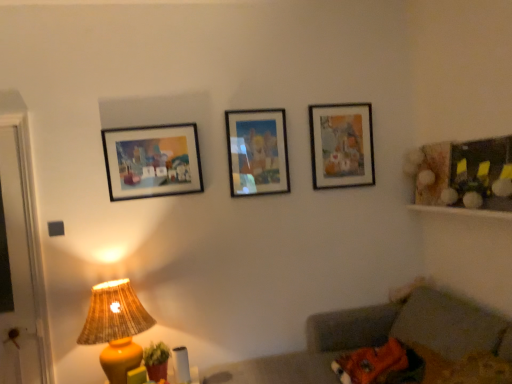
Question: Is matte wooden picture frame at upper right, marked as the 1th picture frame in a right-to-left arrangement, in front of or behind matte plastic picture frame at center, the second picture frame viewed from the left, in the image?

Choices:
 (A) behind
 (B) front

Answer: (A)

Question: Based on their sizes in the image, would you say matte wooden picture frame at upper right, the 3th picture frame when ordered from left to right, is bigger or smaller than matte plastic picture frame at center, positioned as the 2th picture frame in front-to-back order?

Choices:
 (A) big
 (B) small

Answer: (A)

Question: Estimate the real-world distances between objects in this image. Which object is closer to the matte wooden picture frame at upper right, which ranks as the first picture frame in back-to-front order?

Choices:
 (A) matte black picture frame at left, placed as the 1th picture frame when sorted from left to right
 (B) wooden frame at right
 (C) gray fabric couch at lower right
 (D) matte plastic picture frame at center, which is the 2th picture frame from right to left
 (E) yellow matte lampshade at lower left

Answer: (D)

Question: Which is nearer to the matte black picture frame at left, the 3th picture frame viewed from the right?

Choices:
 (A) yellow matte lampshade at lower left
 (B) gray fabric couch at lower right
 (C) matte plastic picture frame at center, positioned as the 2th picture frame in front-to-back order
 (D) matte wooden picture frame at upper right, acting as the third picture frame starting from the front
 (E) wooden frame at right

Answer: (C)